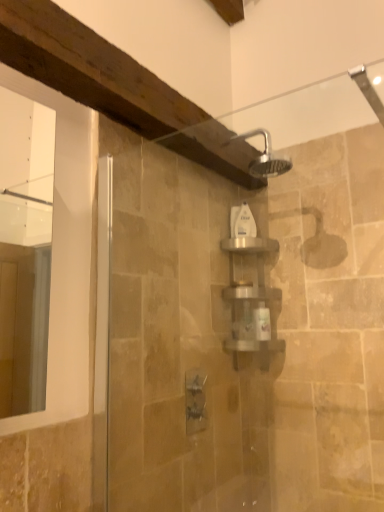
Question: Can we say white plastic bottle at center lies outside satin silver shelf at center?

Choices:
 (A) no
 (B) yes

Answer: (B)

Question: Is white plastic bottle at center wider than satin silver shelf at center?

Choices:
 (A) yes
 (B) no

Answer: (B)

Question: Can you confirm if white plastic bottle at center is positioned to the left of satin silver shelf at center?

Choices:
 (A) yes
 (B) no

Answer: (A)

Question: Does white plastic bottle at center come in front of satin silver shelf at center?

Choices:
 (A) no
 (B) yes

Answer: (A)

Question: Is white plastic bottle at center with satin silver shelf at center?

Choices:
 (A) no
 (B) yes

Answer: (A)

Question: From the image's perspective, is white plastic bottle at center beneath satin silver shelf at center?

Choices:
 (A) yes
 (B) no

Answer: (B)

Question: From the image's perspective, is satin silver shelf at center on top of white plastic bottle at center?

Choices:
 (A) yes
 (B) no

Answer: (B)

Question: From a real-world perspective, is satin silver shelf at center physically below white plastic bottle at center?

Choices:
 (A) yes
 (B) no

Answer: (A)

Question: Considering the relative sizes of satin silver shelf at center and white plastic bottle at center in the image provided, is satin silver shelf at center taller than white plastic bottle at center?

Choices:
 (A) no
 (B) yes

Answer: (B)

Question: Is satin silver shelf at center at the right side of white plastic bottle at center?

Choices:
 (A) no
 (B) yes

Answer: (B)

Question: Is satin silver shelf at center oriented away from white plastic bottle at center?

Choices:
 (A) yes
 (B) no

Answer: (B)

Question: Can you confirm if satin silver shelf at center is shorter than white plastic bottle at center?

Choices:
 (A) yes
 (B) no

Answer: (B)

Question: In the image, is satin silver shelf at center positioned in front of or behind white plastic bottle at center?

Choices:
 (A) front
 (B) behind

Answer: (A)